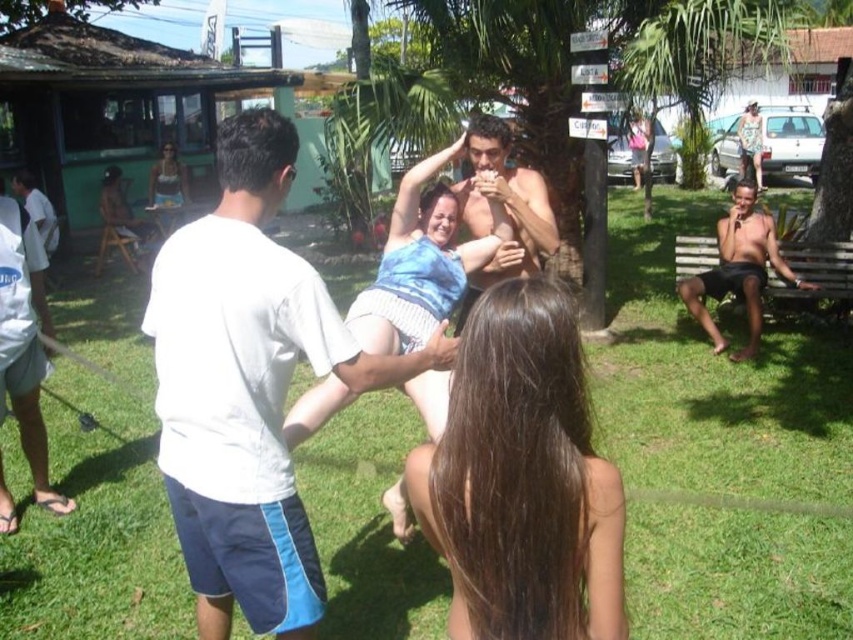
You are a photographer trying to capture a photo of the green grass at center and the white cotton shirt at left. Which one should you focus on first if you want to ensure both are in the frame without moving the camera?

The green grass at center is located above the white cotton shirt at left, so you should focus on the white cotton shirt at left first to ensure both are in the frame without moving the camera.

You are a photographer standing at the center of the park and want to capture both the brown hair at center and the green leafy palm tree at upper center in a single photo. Given that your camera has a maximum focal length that allows capturing objects up to 5 meters apart, will you be able to include both subjects in the frame?

The brown hair at center and the green leafy palm tree at upper center are 5.13 meters apart, which exceeds the camera maximum focal length of 5 meters. Therefore, you cannot include both subjects in the frame.